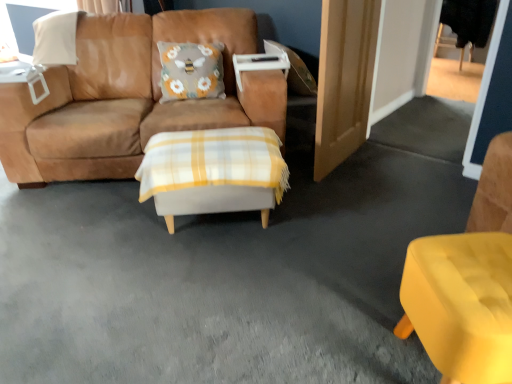
Where is `wooden door at right`? wooden door at right is located at coordinates (344, 79).

Identify the location of wooden door at right. This screenshot has width=512, height=384. (344, 79).

Considering the positions of objects suede brown couch at center and wooden door at right in the image provided, who is more to the right, suede brown couch at center or wooden door at right?

Positioned to the right is wooden door at right.

Does suede brown couch at center have a greater height compared to wooden door at right?

Incorrect, the height of suede brown couch at center is not larger of that of wooden door at right.

From a real-world perspective, is suede brown couch at center above or below wooden door at right?

Clearly, from a real-world perspective, suede brown couch at center is below wooden door at right.

How different are the orientations of suede brown couch at center and wooden door at right in degrees?

The facing directions of suede brown couch at center and wooden door at right are 54.6 degrees apart.

Who is smaller, matte yellow chair at lower right or white plastic table at upper left, placed as the 2th table when sorted from bottom to top?

white plastic table at upper left, placed as the 2th table when sorted from bottom to top.

Is matte yellow chair at lower right inside or outside of white plastic table at upper left, acting as the second table starting from the front?

matte yellow chair at lower right cannot be found inside white plastic table at upper left, acting as the second table starting from the front.

Can you tell me how much matte yellow chair at lower right and white plastic table at upper left, which is the 2th table from right to left, differ in facing direction?

82.3 degrees separate the facing orientations of matte yellow chair at lower right and white plastic table at upper left, which is the 2th table from right to left.

From a real-world perspective, is matte yellow chair at lower right above or below white plastic table at upper left, acting as the second table starting from the front?

Clearly, from a real-world perspective, matte yellow chair at lower right is below white plastic table at upper left, acting as the second table starting from the front.

From the image's perspective, is suede brown couch at center located beneath white plastic table at upper left, which is counted as the 1th table, starting from the back?

No, from the image's perspective, suede brown couch at center is not beneath white plastic table at upper left, which is counted as the 1th table, starting from the back.

The image size is (512, 384). What are the coordinates of `the 1st table positioned below the suede brown couch at center (from the image's perspective)` in the screenshot? It's located at (25, 75).

Is suede brown couch at center taller than white plastic table at upper left, which is counted as the 1th table, starting from the left?

Correct, suede brown couch at center is much taller as white plastic table at upper left, which is counted as the 1th table, starting from the left.

How many degrees apart are the facing directions of suede brown couch at center and white plaid ottoman at center, arranged as the 2th table when viewed from the top?

5.41 degrees.

Measure the distance from suede brown couch at center to white plaid ottoman at center, which is counted as the 2th table, starting from the left.

The distance of suede brown couch at center from white plaid ottoman at center, which is counted as the 2th table, starting from the left, is 22.81 inches.

Would you say suede brown couch at center is a long distance from white plaid ottoman at center, which is counted as the 2th table, starting from the left?

Actually, suede brown couch at center and white plaid ottoman at center, which is counted as the 2th table, starting from the left, are a little close together.

From the image's perspective, which table is the 2nd one below the suede brown couch at center? Please provide its 2D coordinates.

[(213, 171)]

Consider the image. Can you see white plastic table at upper left, which is the 2th table from right to left, touching white plaid ottoman at center, which is counted as the 2th table, starting from the left?

No, white plastic table at upper left, which is the 2th table from right to left, is not in contact with white plaid ottoman at center, which is counted as the 2th table, starting from the left.

Can we say white plastic table at upper left, which is counted as the 1th table, starting from the back, lies outside white plaid ottoman at center, marked as the first table in a bottom-to-top arrangement?

Indeed, white plastic table at upper left, which is counted as the 1th table, starting from the back, is completely outside white plaid ottoman at center, marked as the first table in a bottom-to-top arrangement.

Which is more to the right, white plastic table at upper left, acting as the second table starting from the front, or white plaid ottoman at center, which is counted as the 2th table, starting from the left?

white plaid ottoman at center, which is counted as the 2th table, starting from the left, is more to the right.

Does white plastic table at upper left, which is counted as the 1th table, starting from the left, have a greater width compared to white plaid ottoman at center, marked as the first table in a bottom-to-top arrangement?

In fact, white plastic table at upper left, which is counted as the 1th table, starting from the left, might be narrower than white plaid ottoman at center, marked as the first table in a bottom-to-top arrangement.

Is there a large distance between white plaid ottoman at center, arranged as the 2th table when viewed from the top, and white plastic table at upper left, the 1th table in the top-to-bottom sequence?

That's right, there is a large distance between white plaid ottoman at center, arranged as the 2th table when viewed from the top, and white plastic table at upper left, the 1th table in the top-to-bottom sequence.

From their relative heights in the image, would you say white plaid ottoman at center, acting as the 1th table starting from the front, is taller or shorter than white plastic table at upper left, acting as the second table starting from the front?

Clearly, white plaid ottoman at center, acting as the 1th table starting from the front, is taller compared to white plastic table at upper left, acting as the second table starting from the front.

Considering the sizes of objects white plaid ottoman at center, arranged as the 2th table when viewed from the top, and white plastic table at upper left, placed as the 2th table when sorted from bottom to top, in the image provided, who is wider, white plaid ottoman at center, arranged as the 2th table when viewed from the top, or white plastic table at upper left, placed as the 2th table when sorted from bottom to top,?

white plaid ottoman at center, arranged as the 2th table when viewed from the top.

Considering the points (170, 137) and (42, 69), which point is behind, point (170, 137) or point (42, 69)?

The point (42, 69) is more distant.

Which of these two, white plaid ottoman at center, which is counted as the 2th table, starting from the left, or suede brown couch at center, is thinner?

Thinner between the two is white plaid ottoman at center, which is counted as the 2th table, starting from the left.

Is white plaid ottoman at center, which is counted as the 2th table, starting from the left, shorter than suede brown couch at center?

Correct, white plaid ottoman at center, which is counted as the 2th table, starting from the left, is not as tall as suede brown couch at center.

Can you tell me how much white plaid ottoman at center, which is counted as the 2th table, starting from the left, and suede brown couch at center differ in facing direction?

white plaid ottoman at center, which is counted as the 2th table, starting from the left, and suede brown couch at center are facing 5.41 degrees away from each other.

How much distance is there between white plaid ottoman at center, arranged as the 2th table when viewed from the top, and suede brown couch at center?

white plaid ottoman at center, arranged as the 2th table when viewed from the top, is 57.94 centimeters away from suede brown couch at center.

This screenshot has height=384, width=512. What are the coordinates of `studio couch to the left of wooden door at right` in the screenshot? It's located at (129, 97).

Find the location of a particular element. Image resolution: width=512 pixels, height=384 pixels. chair on the right of white plastic table at upper left, which is counted as the 1th table, starting from the back is located at coordinates (467, 283).

Based on their spatial positions, is suede brown couch at center or wooden door at right further from matte yellow chair at lower right?

suede brown couch at center.

Estimate the real-world distances between objects in this image. Which object is closer to suede brown couch at center, white plaid ottoman at center, acting as the 1th table starting from the front, or wooden door at right?

Among the two, white plaid ottoman at center, acting as the 1th table starting from the front, is located nearer to suede brown couch at center.

From the image, which object appears to be farther from white plastic table at upper left, which is counted as the 1th table, starting from the back, suede brown couch at center or white plaid ottoman at center, acting as the 1th table starting from the front?

The object further to white plastic table at upper left, which is counted as the 1th table, starting from the back, is white plaid ottoman at center, acting as the 1th table starting from the front.

Considering their positions, is white plaid ottoman at center, acting as the 1th table starting from the front, positioned further to white plastic table at upper left, acting as the second table starting from the front, than matte yellow chair at lower right?

matte yellow chair at lower right lies further to white plastic table at upper left, acting as the second table starting from the front, than the other object.

Looking at the image, which one is located closer to wooden door at right, white plastic table at upper left, the 1th table in the top-to-bottom sequence, or white plaid ottoman at center, marked as the 1th table in a right-to-left arrangement?

Based on the image, white plaid ottoman at center, marked as the 1th table in a right-to-left arrangement, appears to be nearer to wooden door at right.

When comparing their distances from white plastic table at upper left, which is counted as the 1th table, starting from the back, does white plaid ottoman at center, marked as the 1th table in a right-to-left arrangement, or wooden door at right seem closer?

white plaid ottoman at center, marked as the 1th table in a right-to-left arrangement, is positioned closer to the anchor white plastic table at upper left, which is counted as the 1th table, starting from the back.

Looking at the image, which one is located further to wooden door at right, suede brown couch at center or white plaid ottoman at center, marked as the first table in a bottom-to-top arrangement?

suede brown couch at center.

Looking at the image, which one is located further to white plastic table at upper left, which is the 2th table from right to left, matte yellow chair at lower right or white plaid ottoman at center, marked as the first table in a bottom-to-top arrangement?

Among the two, matte yellow chair at lower right is located further to white plastic table at upper left, which is the 2th table from right to left.

The width and height of the screenshot is (512, 384). I want to click on door between suede brown couch at center and matte yellow chair at lower right in the horizontal direction, so click(x=344, y=79).

In order to click on table situated between white plastic table at upper left, which is counted as the 1th table, starting from the left, and matte yellow chair at lower right from left to right in this screenshot , I will do `click(213, 171)`.

In order to click on table between suede brown couch at center and wooden door at right in this screenshot , I will do `click(213, 171)`.

At what (x,y) coordinates should I click in order to perform the action: click on studio couch between white plastic table at upper left, which is counted as the 1th table, starting from the left, and matte yellow chair at lower right. Please return your answer as a coordinate pair (x, y). Image resolution: width=512 pixels, height=384 pixels. Looking at the image, I should click on (129, 97).